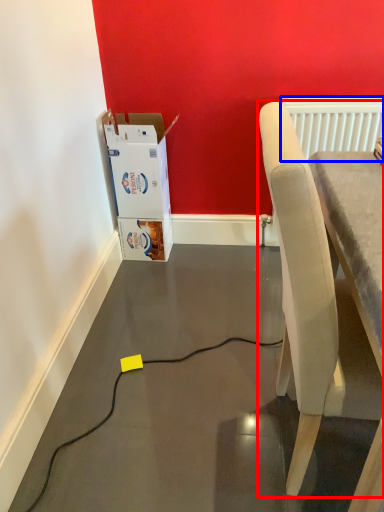
Question: Which of the following is the farthest to the observer, chair (highlighted by a red box) or radiator (highlighted by a blue box)?

Choices:
 (A) chair
 (B) radiator

Answer: (B)